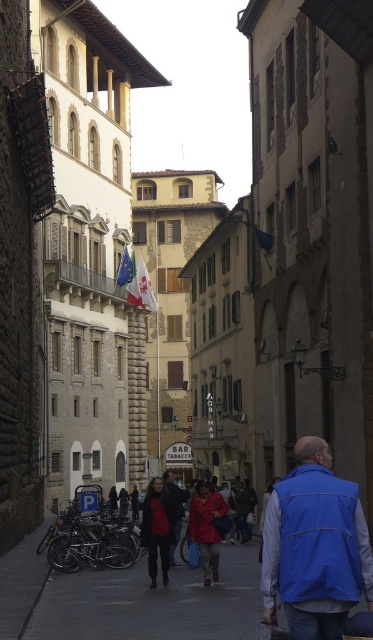
Question: In this image, where is matte black jacket at center located relative to white fabric flag at upper center?

Choices:
 (A) left
 (B) right

Answer: (B)

Question: Which object is farther from the camera taking this photo?

Choices:
 (A) blue softshell vest at center
 (B) matte red coat at center
 (C) white fabric flag at upper center

Answer: (C)

Question: Which point is farther to the camera?

Choices:
 (A) (318, 480)
 (B) (139, 296)

Answer: (B)

Question: Which object is the closest to the blue softshell vest at center?

Choices:
 (A) matte red coat at center
 (B) white fabric flag at upper center
 (C) matte black jacket at center

Answer: (A)

Question: Can you confirm if matte red coat at center is positioned above red leather jacket at center?

Choices:
 (A) no
 (B) yes

Answer: (B)

Question: Can you confirm if matte black jacket at center is positioned below white fabric flag at upper center?

Choices:
 (A) no
 (B) yes

Answer: (B)